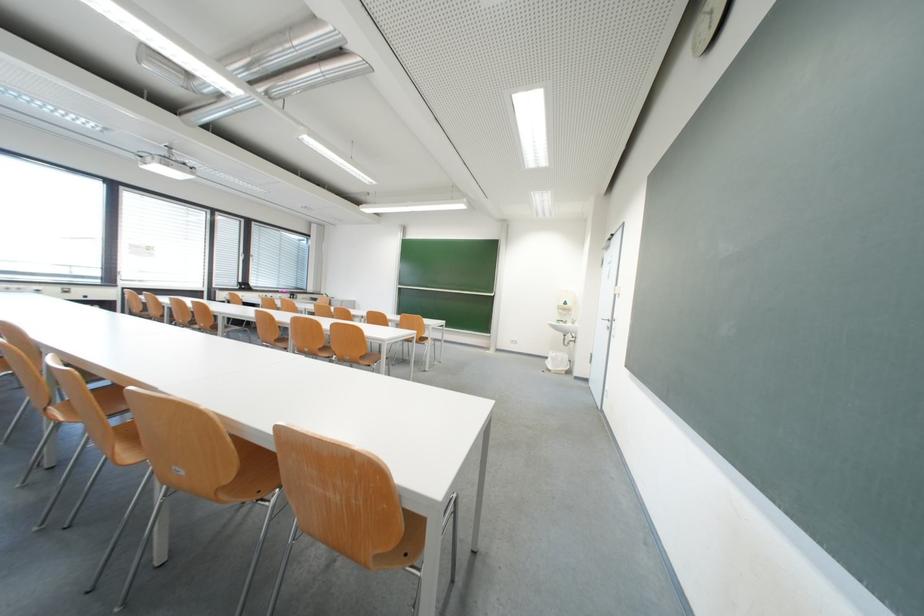
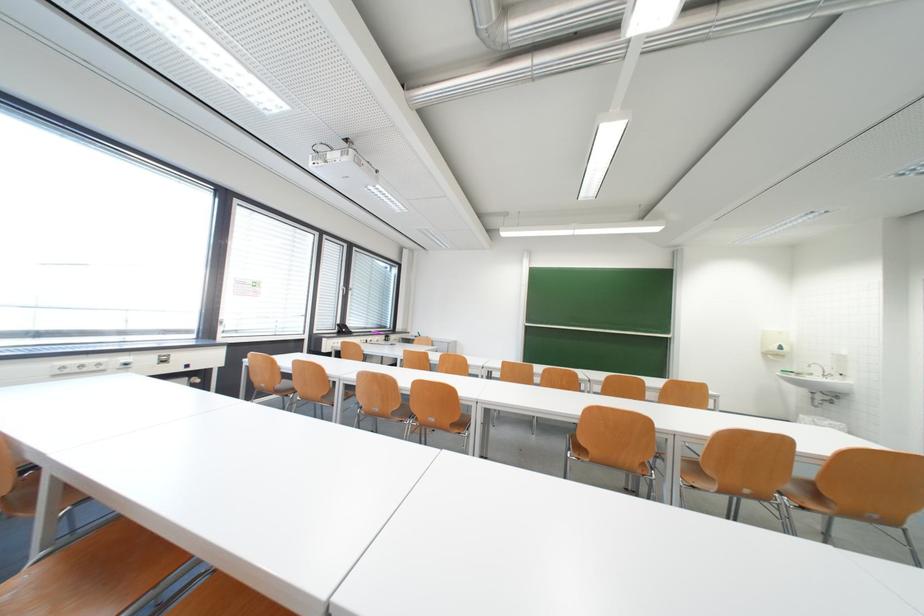
The point at (x=66, y=291) is marked in the first image. Where is the corresponding point in the second image?

(160, 359)